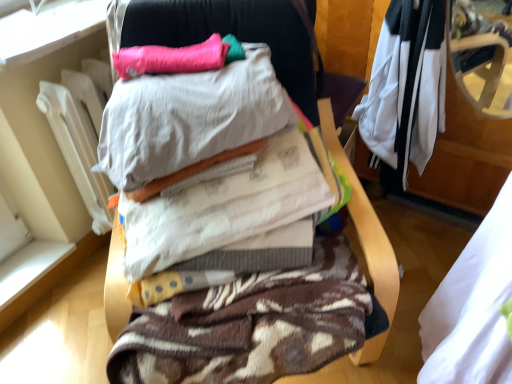
This screenshot has width=512, height=384. In order to click on free space in front of pink fluffy pillow at upper center, which ranks as the first pillow in back-to-front order in this screenshot , I will do `click(169, 89)`.